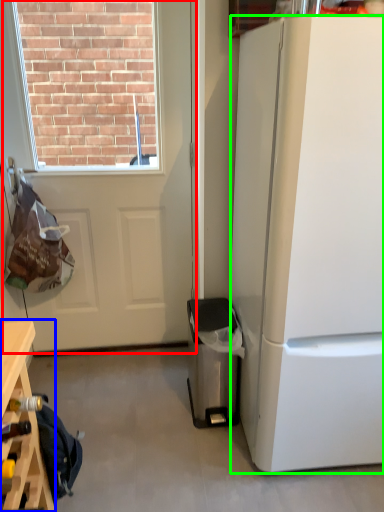
Question: Based on their relative distances, which object is farther from door (highlighted by a red box)? Choose from table (highlighted by a blue box) and refrigerator (highlighted by a green box).

Choices:
 (A) table
 (B) refrigerator

Answer: (A)